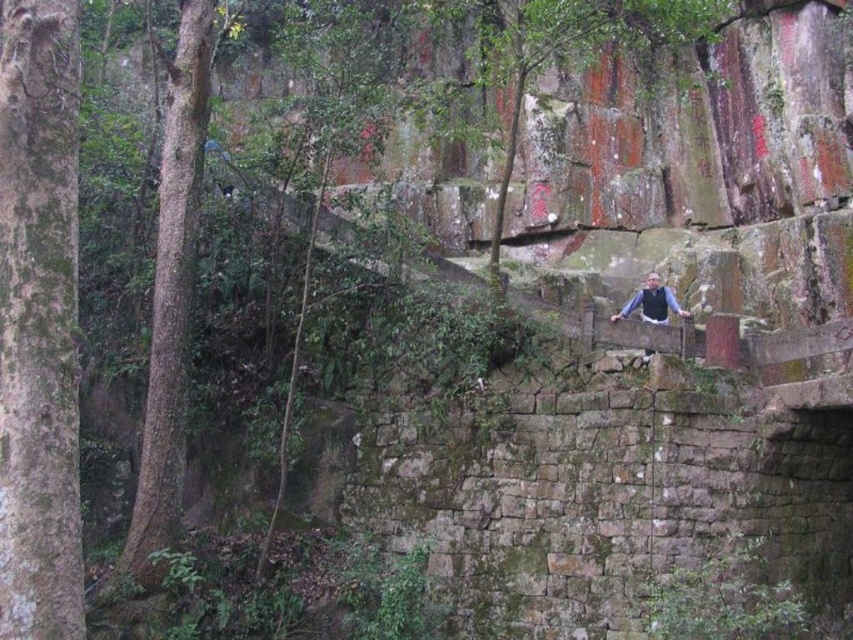
In the scene shown: You are a hiker trying to determine which tree to rest against. Both the green mossy bark tree at left and the green rough bark tree at left are options. Which tree has a smaller physical footprint?

The green mossy bark tree at left has a smaller physical footprint than the green rough bark tree at left because it occupies less space according to the description.

You are a hiker trying to navigate between the green mossy bark tree at left and the green rough bark tree at left. If your backpack has a 10 meter rope, can you safely tie the rope between them to cross?

The distance between the green mossy bark tree at left and the green rough bark tree at left is 12.28 meters. Since the rope is only 10 meters long, it is not long enough to safely span the gap between them.

You are a hiker trying to identify two trees on your left side. Which tree is positioned lower down the slope between the green mossy bark tree at left and the green rough bark tree at left?

The green mossy bark tree at left is positioned lower down the slope because it is located below the green rough bark tree at left.